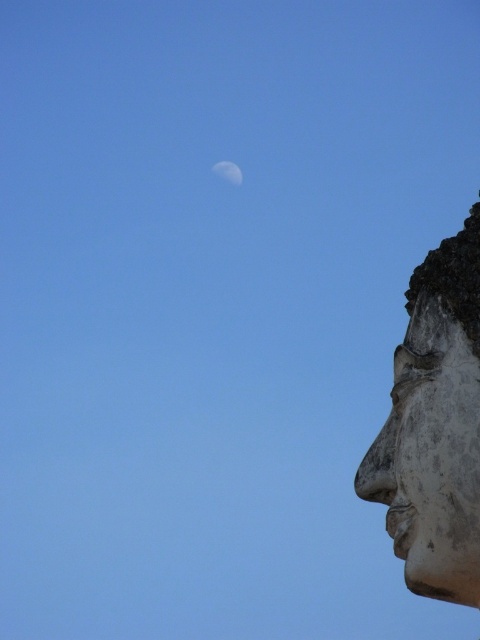
Question: Does white stone face at right have a lesser width compared to white glossy moon at upper center?

Choices:
 (A) no
 (B) yes

Answer: (A)

Question: Is white stone face at right to the right of white glossy moon at upper center from the viewer's perspective?

Choices:
 (A) yes
 (B) no

Answer: (A)

Question: Which point is farther from the camera taking this photo?

Choices:
 (A) (445, 436)
 (B) (240, 182)

Answer: (B)

Question: Can you confirm if white stone face at right is thinner than white glossy moon at upper center?

Choices:
 (A) yes
 (B) no

Answer: (B)

Question: Which object is farther from the camera taking this photo?

Choices:
 (A) white glossy moon at upper center
 (B) white stone face at right

Answer: (A)